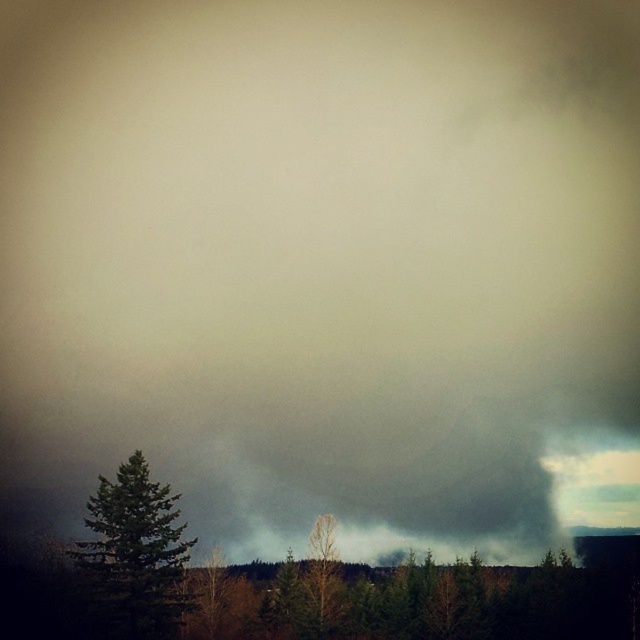
Describe the element at coordinates (499, 598) in the screenshot. The height and width of the screenshot is (640, 640). I see `green matte trees at lower center` at that location.

Does green matte trees at lower center have a greater width compared to green matte tree at center?

Yes, green matte trees at lower center is wider than green matte tree at center.

Locate an element on the screen. This screenshot has height=640, width=640. green matte trees at lower center is located at coordinates (499, 598).

Is green matte tree at lower left shorter than green matte tree at center?

Yes, green matte tree at lower left is shorter than green matte tree at center.

Does green matte tree at lower left have a greater height compared to green matte tree at center?

No.

The image size is (640, 640). What do you see at coordinates (134, 556) in the screenshot?
I see `green matte tree at lower left` at bounding box center [134, 556].

Find the location of `green matte tree at lower left`. green matte tree at lower left is located at coordinates (134, 556).

Does point (593, 570) lie behind point (147, 632)?

That is True.

Find the location of `green matte trees at lower center`. green matte trees at lower center is located at coordinates (499, 598).

Identify the location of green matte trees at lower center. The height and width of the screenshot is (640, 640). (499, 598).